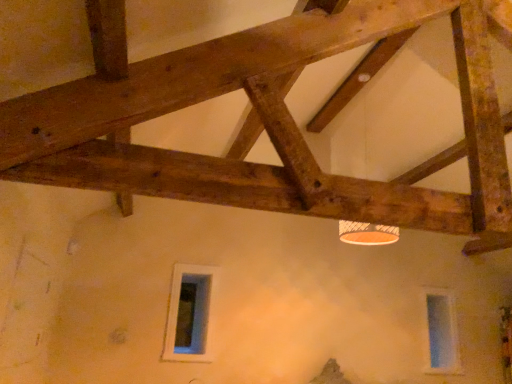
Question: Could you tell me if transparent glass window at lower right, acting as the 1th window starting from the back, is turned towards orange matte lamp at upper center?

Choices:
 (A) no
 (B) yes

Answer: (A)

Question: Is transparent glass window at lower right, the 2th window viewed from the left, beside orange matte lamp at upper center?

Choices:
 (A) no
 (B) yes

Answer: (A)

Question: Does transparent glass window at lower right, acting as the 1th window starting from the back, have a greater width compared to orange matte lamp at upper center?

Choices:
 (A) no
 (B) yes

Answer: (A)

Question: From the image's perspective, is transparent glass window at lower right, the 2th window viewed from the left, beneath orange matte lamp at upper center?

Choices:
 (A) no
 (B) yes

Answer: (B)

Question: Can you confirm if transparent glass window at lower right, arranged as the second window when viewed from the front, is positioned to the left of orange matte lamp at upper center?

Choices:
 (A) no
 (B) yes

Answer: (A)

Question: Is transparent glass window at lower right, acting as the 1th window starting from the back, wider or thinner than orange matte lamp at upper center?

Choices:
 (A) wide
 (B) thin

Answer: (B)

Question: Considering the positions of transparent glass window at lower right, acting as the first window starting from the right, and orange matte lamp at upper center in the image, is transparent glass window at lower right, acting as the first window starting from the right, bigger or smaller than orange matte lamp at upper center?

Choices:
 (A) big
 (B) small

Answer: (B)

Question: Does point (429, 324) appear closer or farther from the camera than point (352, 226)?

Choices:
 (A) farther
 (B) closer

Answer: (A)

Question: Do you think transparent glass window at lower right, arranged as the second window when viewed from the front, is within orange matte lamp at upper center, or outside of it?

Choices:
 (A) outside
 (B) inside

Answer: (A)

Question: From the image's perspective, is orange matte lamp at upper center above or below white glass window at lower center, the 2th window in the back-to-front sequence?

Choices:
 (A) above
 (B) below

Answer: (A)

Question: In terms of height, does orange matte lamp at upper center look taller or shorter compared to white glass window at lower center, arranged as the 1th window when viewed from the front?

Choices:
 (A) tall
 (B) short

Answer: (A)

Question: Is point (346, 228) positioned closer to the camera than point (164, 336)?

Choices:
 (A) farther
 (B) closer

Answer: (B)

Question: From a real-world perspective, is orange matte lamp at upper center above or below white glass window at lower center, which ranks as the first window in left-to-right order?

Choices:
 (A) below
 (B) above

Answer: (B)

Question: Looking at the image, does transparent glass window at lower right, arranged as the second window when viewed from the front, seem bigger or smaller compared to white glass window at lower center, arranged as the 1th window when viewed from the front?

Choices:
 (A) big
 (B) small

Answer: (A)

Question: Relative to white glass window at lower center, arranged as the 1th window when viewed from the front, is transparent glass window at lower right, acting as the 1th window starting from the back, in front or behind?

Choices:
 (A) behind
 (B) front

Answer: (A)